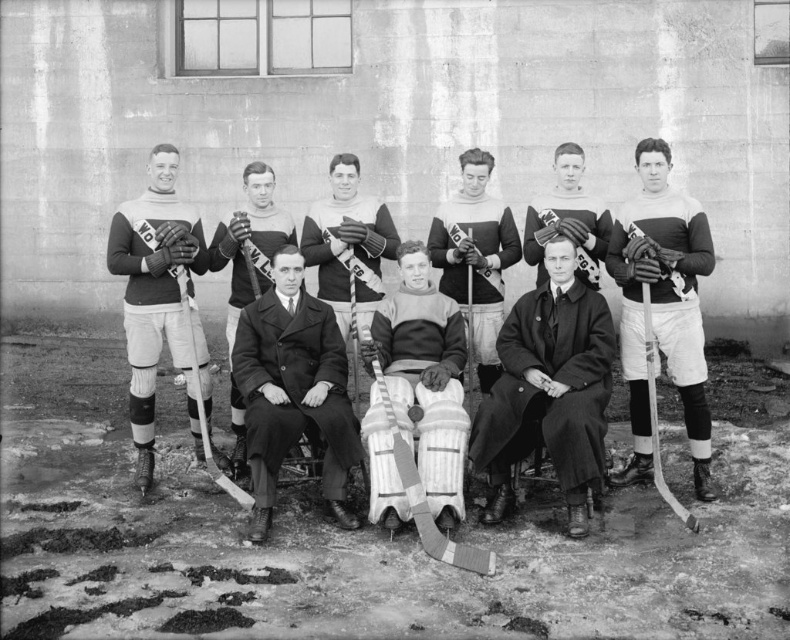
Can you confirm if smooth black suit at center is positioned below wooden textured hockey stick at center?

No, smooth black suit at center is not below wooden textured hockey stick at center.

Does smooth black suit at center have a smaller size compared to wooden textured hockey stick at center?

Incorrect, smooth black suit at center is not smaller in size than wooden textured hockey stick at center.

The width and height of the screenshot is (790, 640). What are the coordinates of `smooth black suit at center` in the screenshot? It's located at point(292,388).

Which is in front, point (438, 362) or point (316, 257)?

Point (438, 362) is more forward.

Between striped jersey at center and dark brown leather gloves at upper center, which one appears on the left side from the viewer's perspective?

From the viewer's perspective, dark brown leather gloves at upper center appears more on the left side.

This screenshot has width=790, height=640. What are the coordinates of `striped jersey at center` in the screenshot? It's located at 427,387.

Is smooth black suit at center wider than matte black hockey uniform at left?

Indeed, smooth black suit at center has a greater width compared to matte black hockey uniform at left.

Is point (281, 356) closer to viewer compared to point (190, 408)?

Yes, point (281, 356) is in front of point (190, 408).

The height and width of the screenshot is (640, 790). What do you see at coordinates (292, 388) in the screenshot?
I see `smooth black suit at center` at bounding box center [292, 388].

Image resolution: width=790 pixels, height=640 pixels. Identify the location of smooth black suit at center. coord(292,388).